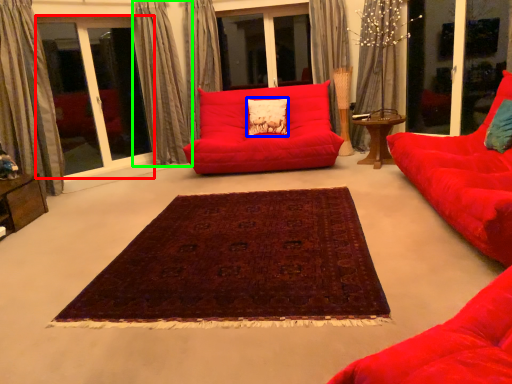
Question: Which is nearer to the bay window (highlighted by a red box)? pillow (highlighted by a blue box) or curtain (highlighted by a green box).

Choices:
 (A) pillow
 (B) curtain

Answer: (B)